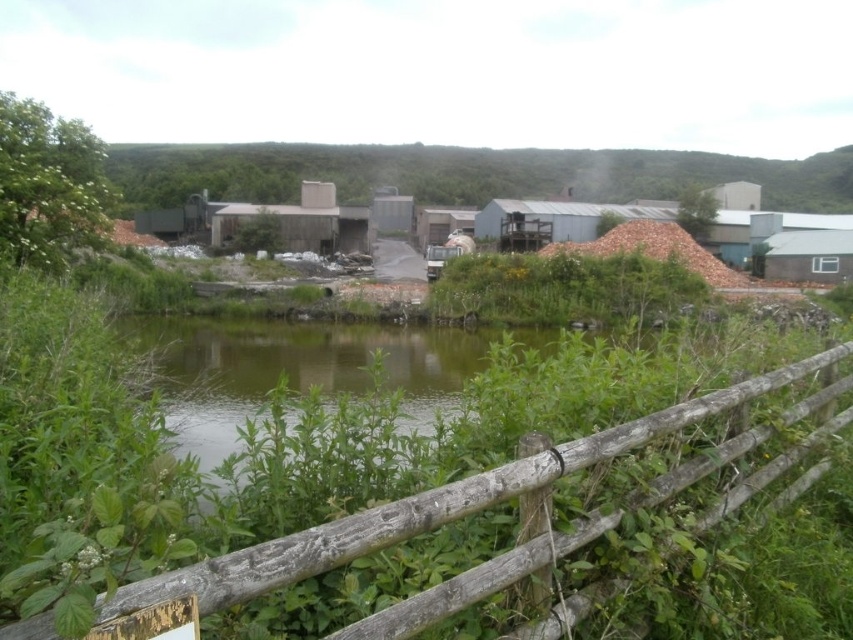
Which is above, weathered wood fence at lower center or green leafy vegetation at center?

green leafy vegetation at center is higher up.

Who is more forward, (402, 518) or (595, 291)?

Point (402, 518) is in front.

Which is behind, point (543, 456) or point (463, 276)?

Positioned behind is point (463, 276).

At what (x,y) coordinates should I click in order to perform the action: click on weathered wood fence at lower center. Please return your answer as a coordinate pair (x, y). Looking at the image, I should click on (427, 506).

Is green grassy river at center taller than weathered wood fence at lower center?

Yes.

Who is lower down, green grassy river at center or weathered wood fence at lower center?

green grassy river at center is below.

The width and height of the screenshot is (853, 640). Identify the location of green grassy river at center. (303, 368).

Who is taller, green grassy river at center or green leafy bush at upper left?

With more height is green grassy river at center.

Image resolution: width=853 pixels, height=640 pixels. I want to click on green grassy river at center, so (x=303, y=368).